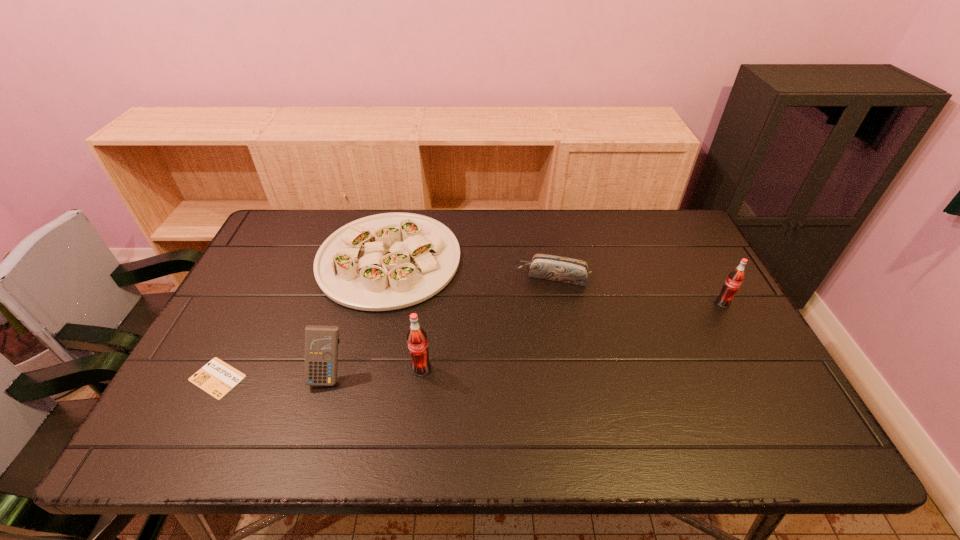
Find the location of a particular element. vacant region at the far edge of the desktop is located at coordinates (477, 215).

Identify the location of vacant space at the right edge of the desktop. (661, 265).

In the image, there is a desktop. In order to click on free space at the far right corner in this screenshot , I will do `click(678, 214)`.

You are a GUI agent. You are given a task and a screenshot of the screen. Output one action in this format:
    pyautogui.click(x=<x>, y=<y>)
    Task: Click on the vacant space at the near right corner of the desktop
    
    Given the screenshot: What is the action you would take?
    pyautogui.click(x=775, y=404)

The image size is (960, 540). In order to click on free space between the shortest object and the calculator in this screenshot , I will do point(274,376).

You are a GUI agent. You are given a task and a screenshot of the screen. Output one action in this format:
    pyautogui.click(x=<x>, y=<y>)
    Task: Click on the free space that is in between the nearer soda bottle and the platter
    The height and width of the screenshot is (540, 960).
    Given the screenshot: What is the action you would take?
    pyautogui.click(x=405, y=314)

This screenshot has width=960, height=540. In order to click on vacant area that lies between the farther soda bottle and the platter in this screenshot , I will do (x=556, y=281).

Find the location of `blank region between the platter and the second object from right to left`. blank region between the platter and the second object from right to left is located at coordinates (470, 268).

This screenshot has height=540, width=960. Find the location of `free spot between the rightmost object and the calculator`. free spot between the rightmost object and the calculator is located at coordinates (526, 339).

At what (x,y) coordinates should I click in order to perform the action: click on free area in between the leftmost object and the shorter soda bottle. Please return your answer as a coordinate pair (x, y). Image resolution: width=960 pixels, height=540 pixels. Looking at the image, I should click on (470, 341).